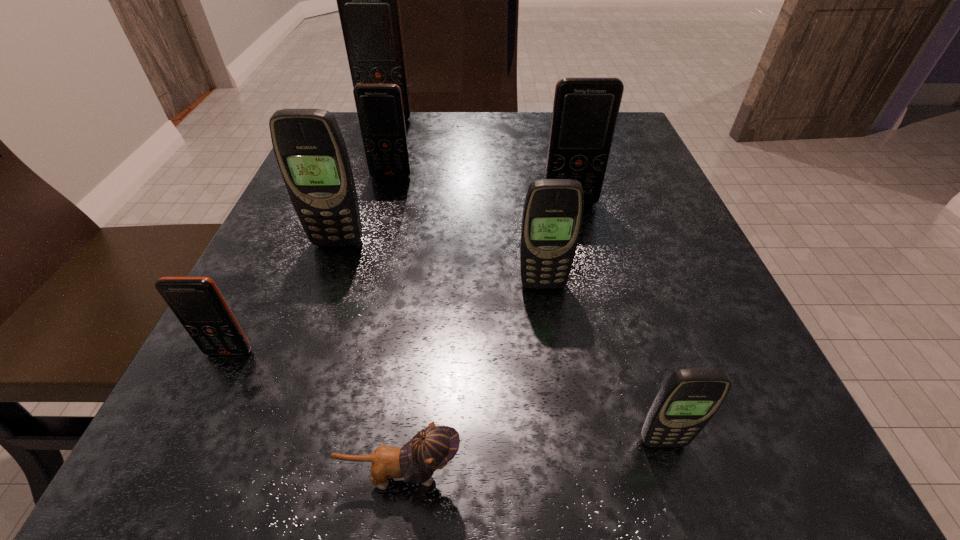
Image resolution: width=960 pixels, height=540 pixels. I want to click on the leftmost orange cellular telephone, so click(x=197, y=303).

Where is `the nearest orange cellular telephone`? Image resolution: width=960 pixels, height=540 pixels. the nearest orange cellular telephone is located at coordinates (197, 303).

Locate an element on the screen. The image size is (960, 540). the smallest gray cellular telephone is located at coordinates (689, 398).

You are a GUI agent. You are given a task and a screenshot of the screen. Output one action in this format:
    pyautogui.click(x=<x>, y=<y>)
    Task: Click on the nearest cellular telephone
    Image resolution: width=960 pixels, height=540 pixels.
    Given the screenshot: What is the action you would take?
    pyautogui.click(x=689, y=398)

The width and height of the screenshot is (960, 540). I want to click on the nearest object, so click(433, 447).

Where is `kitten`? The width and height of the screenshot is (960, 540). kitten is located at coordinates [433, 447].

You are a GUI agent. You are given a task and a screenshot of the screen. Output one action in this format:
    pyautogui.click(x=<x>, y=<y>)
    Task: Click on the vacant space situated on the screen of the biggest orange cellular telephone
    
    Given the screenshot: What is the action you would take?
    pyautogui.click(x=372, y=165)

The image size is (960, 540). Find the location of `free location located 0.360m on the screen of the second nearest orange cellular telephone`. free location located 0.360m on the screen of the second nearest orange cellular telephone is located at coordinates (613, 380).

The height and width of the screenshot is (540, 960). I want to click on free space located 0.340m on the screen of the leftmost gray cellular telephone, so point(264,454).

This screenshot has height=540, width=960. In order to click on free space located on the screen of the fifth farthest cellular telephone in this screenshot , I will do `click(568, 467)`.